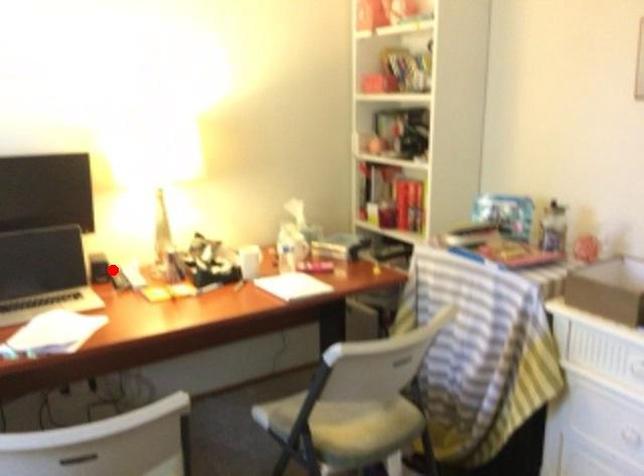
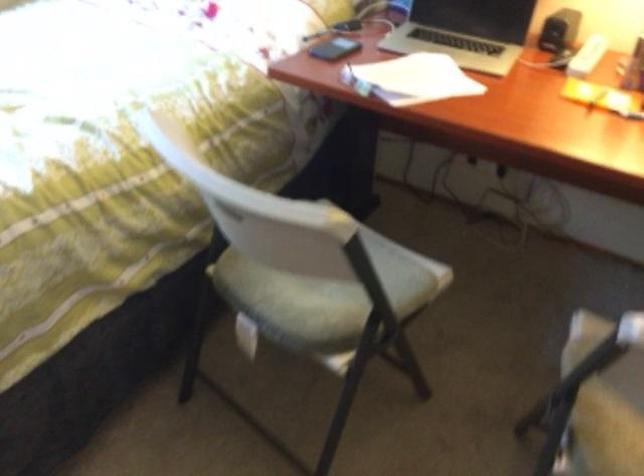
The point at the highlighted location is marked in the first image. Where is the corresponding point in the second image?

(559, 30)